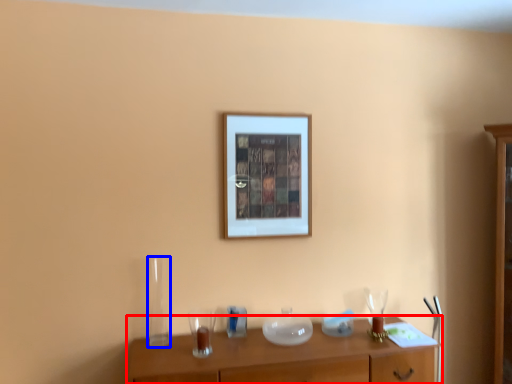
Question: Among these objects, which one is nearest to the camera, table (highlighted by a red box) or glass vase (highlighted by a blue box)?

Choices:
 (A) table
 (B) glass vase

Answer: (A)